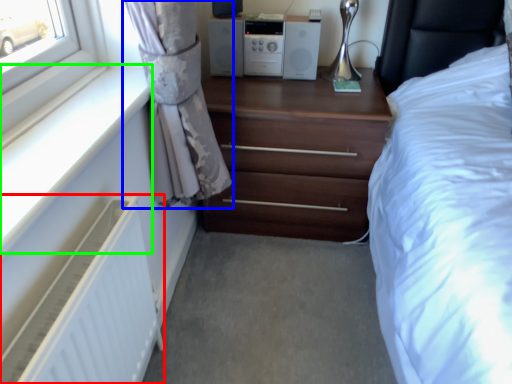
Question: Which object is the closest to the radiator (highlighted by a red box)? Choose among these: curtain (highlighted by a blue box) or window sill (highlighted by a green box).

Choices:
 (A) curtain
 (B) window sill

Answer: (B)